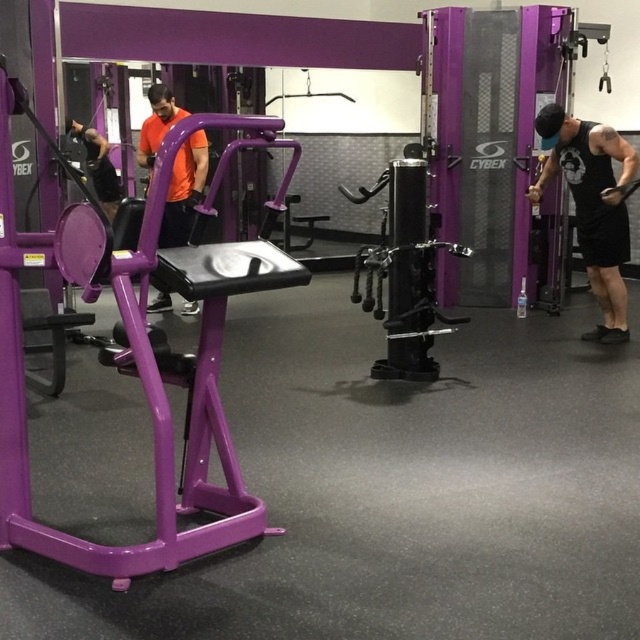
Question: Which object appears closest to the camera in this image?

Choices:
 (A) orange fabric shirt at center
 (B) black matte tank top at right

Answer: (B)

Question: Can you confirm if black matte tank top at right is bigger than orange fabric shirt at center?

Choices:
 (A) yes
 (B) no

Answer: (A)

Question: Among these points, which one is farthest from the camera?

Choices:
 (A) (611, 252)
 (B) (173, 100)

Answer: (B)

Question: Is black matte tank top at right behind orange fabric shirt at center?

Choices:
 (A) yes
 (B) no

Answer: (B)

Question: Does black matte tank top at right appear under orange fabric shirt at center?

Choices:
 (A) no
 (B) yes

Answer: (B)